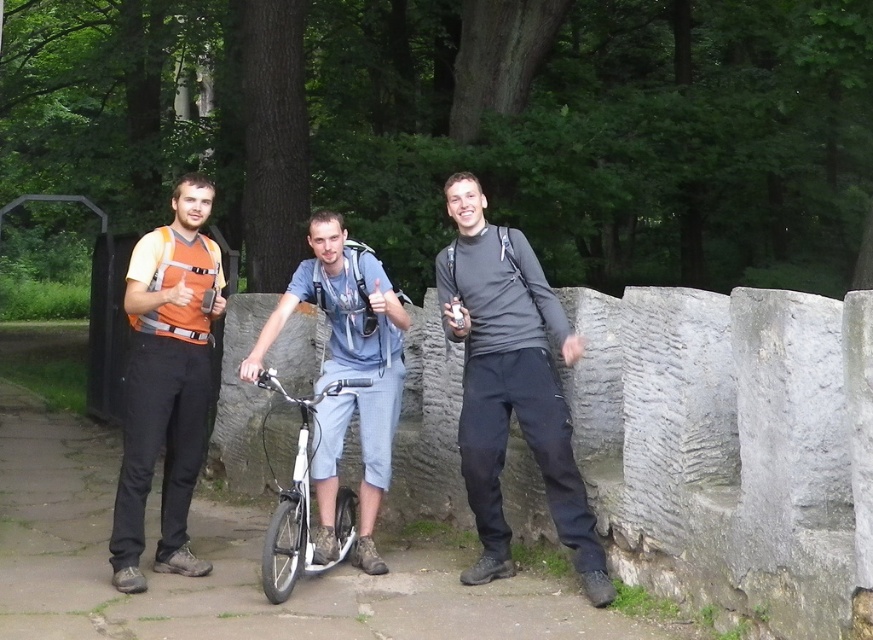
You are standing in a park and see a point marked at coordinates (540, 465). If you want to place a 10 feet long bench there, will it fit without overlapping the stone wall behind?

The distance of point (540, 465) from viewer is 22.02 feet. Since the bench is 10 feet long, it will fit as there is enough space between the point and the stone wall.

You are standing at the stone wall and want to walk towards the two points marked in the image. Which point would you reach first, point (121, 564) or point (260, 422)?

Point (121, 564) is in front of point (260, 422), so you would reach point (121, 564) first.